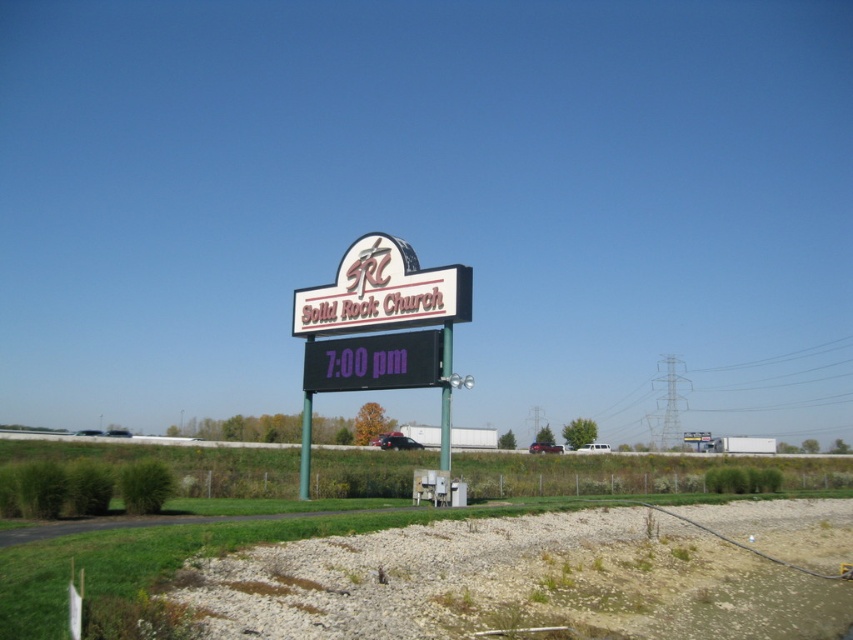
Question: Which of the following is the closest to the observer?

Choices:
 (A) (410, 342)
 (B) (399, 362)
 (C) (306, 337)

Answer: (A)

Question: Considering the real-world distances, which object is closest to the black digital clock at center?

Choices:
 (A) metallic sign at center
 (B) white plastic sign at center

Answer: (A)

Question: Observing the image, what is the correct spatial positioning of metallic sign at center in reference to black digital clock at center?

Choices:
 (A) left
 (B) right

Answer: (A)

Question: Considering the relative positions of white plastic sign at center and black digital clock at center in the image provided, where is white plastic sign at center located with respect to black digital clock at center?

Choices:
 (A) left
 (B) right

Answer: (A)

Question: Which object is closer to the camera taking this photo?

Choices:
 (A) white plastic sign at center
 (B) black digital clock at center

Answer: (B)

Question: Does metallic sign at center have a larger size compared to white plastic sign at center?

Choices:
 (A) yes
 (B) no

Answer: (A)